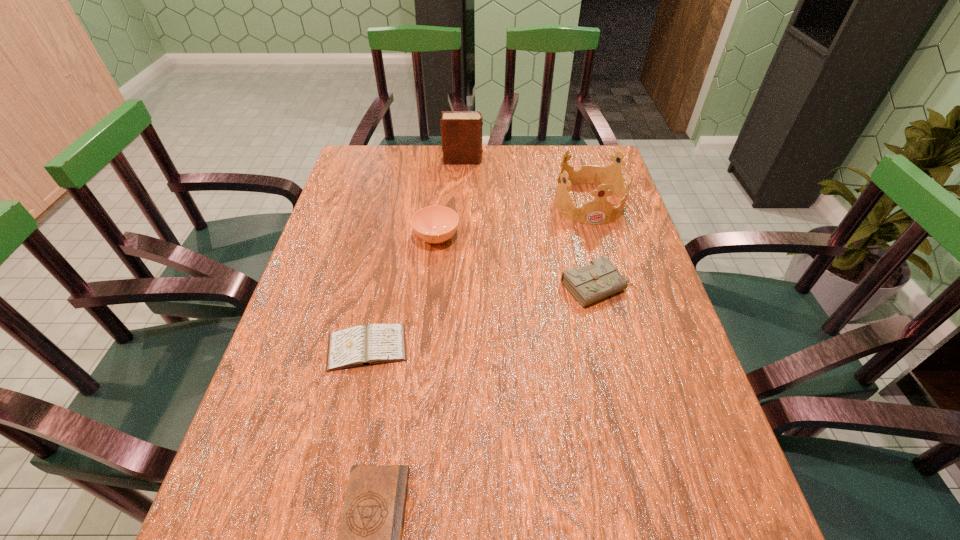
You are a GUI agent. You are given a task and a screenshot of the screen. Output one action in this format:
    pyautogui.click(x=<x>, y=<y>)
    Task: Click on the vacant region at the right edge of the desktop
    The height and width of the screenshot is (540, 960).
    Given the screenshot: What is the action you would take?
    pyautogui.click(x=623, y=305)

Where is `vacant area at the far right corner`? The image size is (960, 540). vacant area at the far right corner is located at coordinates (592, 165).

You are a GUI agent. You are given a task and a screenshot of the screen. Output one action in this format:
    pyautogui.click(x=<x>, y=<y>)
    Task: Click on the free space between the farthest object and the second nearest diary
    This screenshot has width=960, height=540.
    Given the screenshot: What is the action you would take?
    pyautogui.click(x=415, y=254)

You are a GUI agent. You are given a task and a screenshot of the screen. Output one action in this format:
    pyautogui.click(x=<x>, y=<y>)
    Task: Click on the free space between the soup bowl and the fourth farthest object
    
    Given the screenshot: What is the action you would take?
    pyautogui.click(x=517, y=262)

Locate an element on the screen. vacant space that's between the fifth shortest object and the third farthest diary is located at coordinates (478, 275).

Locate an element on the screen. The width and height of the screenshot is (960, 540). vacant area that lies between the second tallest object and the fourth shortest object is located at coordinates (513, 220).

Where is `vacant space that's between the third farthest diary and the second tallest object`? This screenshot has width=960, height=540. vacant space that's between the third farthest diary and the second tallest object is located at coordinates (478, 275).

Select which object appears as the third closest to the tiara. Please provide its 2D coordinates. Your answer should be formatted as a tuple, i.e. [(x, y)], where the tuple contains the x and y coordinates of a point satisfying the conditions above.

[(434, 224)]

Identify the location of object that can be found as the second closest to the tiara. (461, 131).

Find the location of a particular element. The height and width of the screenshot is (540, 960). diary that is the fourth closest to the second tallest object is located at coordinates (369, 539).